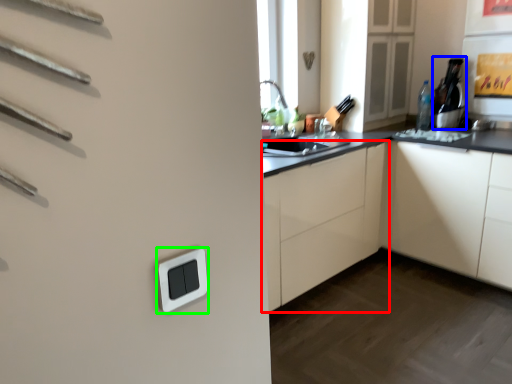
Question: Which object is positioned farthest from cabinetry (highlighted by a red box)? Select from appliance (highlighted by a blue box) and light switch (highlighted by a green box).

Choices:
 (A) appliance
 (B) light switch

Answer: (B)